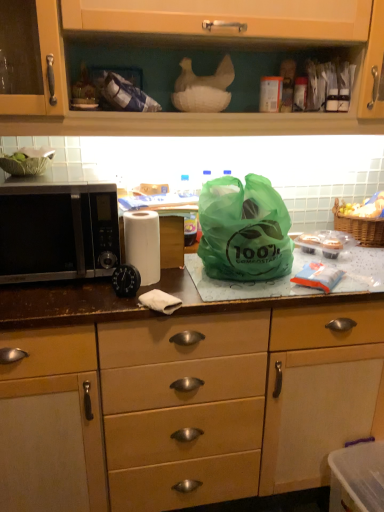
Describe the element at coordinates (365, 207) in the screenshot. This screenshot has height=512, width=384. I see `yellowish matte fruit at upper right` at that location.

Describe the element at coordinates (187, 124) in the screenshot. The width and height of the screenshot is (384, 512). I see `matte wood cabinet at upper center, which is the second cabinetry in bottom-to-top order` at that location.

You are a GUI agent. You are given a task and a screenshot of the screen. Output one action in this format:
    pyautogui.click(x=<x>, y=<y>)
    Task: Click on the woven brown picnic basket at right
    
    Given the screenshot: What is the action you would take?
    pyautogui.click(x=360, y=227)

From the image's perspective, is black matte microwave at left located above or below matte wood cabinet at upper center, which is the second cabinetry in bottom-to-top order?

Clearly, from the image's perspective, black matte microwave at left is below matte wood cabinet at upper center, which is the second cabinetry in bottom-to-top order.

Is black matte microwave at left far away from matte wood cabinet at upper center, positioned as the 1th cabinetry in top-to-bottom order?

No, black matte microwave at left is not far away from matte wood cabinet at upper center, positioned as the 1th cabinetry in top-to-bottom order.

Does black matte microwave at left turn towards matte wood cabinet at upper center, positioned as the 1th cabinetry in top-to-bottom order?

No, black matte microwave at left does not turn towards matte wood cabinet at upper center, positioned as the 1th cabinetry in top-to-bottom order.

Which is more to the left, black matte microwave at left or matte wood cabinet at upper center, which is the second cabinetry in bottom-to-top order?

black matte microwave at left.

Which of these two, black matte microwave at left or green translucent bag at center, is wider?

black matte microwave at left is wider.

Is black matte microwave at left to the right of green translucent bag at center from the viewer's perspective?

Incorrect, black matte microwave at left is not on the right side of green translucent bag at center.

From a real-world perspective, is black matte microwave at left under green translucent bag at center?

Correct, in the physical world, black matte microwave at left is lower than green translucent bag at center.

Would you consider black matte microwave at left to be distant from green translucent bag at center?

That's not correct — black matte microwave at left is a little close to green translucent bag at center.

In terms of width, does black matte microwave at left look wider or thinner when compared to matte brown cabinet at center, which is the 2th cabinetry from top to bottom?

Clearly, black matte microwave at left has less width compared to matte brown cabinet at center, which is the 2th cabinetry from top to bottom.

From the image's perspective, is black matte microwave at left on top of matte brown cabinet at center, which is the 2th cabinetry from top to bottom?

Correct, black matte microwave at left appears higher than matte brown cabinet at center, which is the 2th cabinetry from top to bottom, in the image.

Is black matte microwave at left next to matte brown cabinet at center, acting as the first cabinetry starting from the bottom?

No, black matte microwave at left is not beside matte brown cabinet at center, acting as the first cabinetry starting from the bottom.

Considering the sizes of objects black matte microwave at left and matte brown cabinet at center, acting as the first cabinetry starting from the bottom, in the image provided, who is smaller, black matte microwave at left or matte brown cabinet at center, acting as the first cabinetry starting from the bottom,?

black matte microwave at left.

In the image, there is a matte wood cabinet at upper center, which is the second cabinetry in bottom-to-top order. In order to click on paper towel below it (from the image's perspective) in this screenshot , I will do `click(143, 244)`.

In terms of height, does matte wood cabinet at upper center, positioned as the 1th cabinetry in top-to-bottom order, look taller or shorter compared to white matte paper towel at center?

Clearly, matte wood cabinet at upper center, positioned as the 1th cabinetry in top-to-bottom order, is taller compared to white matte paper towel at center.

Considering the relative positions of matte wood cabinet at upper center, which is the second cabinetry in bottom-to-top order, and white matte paper towel at center in the image provided, is matte wood cabinet at upper center, which is the second cabinetry in bottom-to-top order, to the left or to the right of white matte paper towel at center?

Clearly, matte wood cabinet at upper center, which is the second cabinetry in bottom-to-top order, is on the right of white matte paper towel at center in the image.

Considering the relative sizes of matte wood cabinet at upper center, positioned as the 1th cabinetry in top-to-bottom order, and white matte paper towel at center in the image provided, is matte wood cabinet at upper center, positioned as the 1th cabinetry in top-to-bottom order, thinner than white matte paper towel at center?

No.

Can you confirm if white matte paper towel at center is thinner than black matte microwave at left?

Indeed, white matte paper towel at center has a lesser width compared to black matte microwave at left.

Is white matte paper towel at center to the right of black matte microwave at left from the viewer's perspective?

Yes, white matte paper towel at center is to the right of black matte microwave at left.

Considering the positions of point (140, 267) and point (64, 233), is point (140, 267) closer or farther from the camera than point (64, 233)?

Point (140, 267) is farther from the camera than point (64, 233).

In the scene shown: Are white matte paper towel at center and black matte microwave at left located far from each other?

Actually, white matte paper towel at center and black matte microwave at left are a little close together.

From the image's perspective, is woven brown picnic basket at right beneath matte wood cabinet at upper center, positioned as the 1th cabinetry in top-to-bottom order?

Yes, from the image's perspective, woven brown picnic basket at right is beneath matte wood cabinet at upper center, positioned as the 1th cabinetry in top-to-bottom order.

Which is behind, point (369, 244) or point (157, 133)?

Positioned behind is point (369, 244).

In the scene shown: Is woven brown picnic basket at right directly adjacent to matte wood cabinet at upper center, positioned as the 1th cabinetry in top-to-bottom order?

There is a gap between woven brown picnic basket at right and matte wood cabinet at upper center, positioned as the 1th cabinetry in top-to-bottom order.

Is white matte paper towel at center not close to woven brown picnic basket at right?

No, white matte paper towel at center is not far away from woven brown picnic basket at right.

Which object is closer to the camera taking this photo, white matte paper towel at center or woven brown picnic basket at right?

Positioned in front is white matte paper towel at center.

Considering the positions of points (137, 255) and (360, 230), is point (137, 255) farther from camera compared to point (360, 230)?

No, (137, 255) is in front of (360, 230).

Which of these two, white matte paper towel at center or woven brown picnic basket at right, stands shorter?

woven brown picnic basket at right is shorter.

Locate an element on the screen. The height and width of the screenshot is (512, 384). the 1st cabinetry to the right of the black matte microwave at left, counting from the anchor's position is located at coordinates (187, 124).

In order to click on microwave oven in front of the green translucent bag at center in this screenshot , I will do `click(58, 233)`.

Considering their positions, is yellowish matte fruit at upper right positioned further to green translucent bag at center than woven brown picnic basket at right?

yellowish matte fruit at upper right is positioned further to the anchor green translucent bag at center.

Considering their positions, is woven brown picnic basket at right positioned closer to white matte paper towel at center than matte wood cabinet at upper center, positioned as the 1th cabinetry in top-to-bottom order?

matte wood cabinet at upper center, positioned as the 1th cabinetry in top-to-bottom order.

Which object lies nearer to the anchor point yellowish matte fruit at upper right, woven brown picnic basket at right or green translucent bag at center?

Based on the image, woven brown picnic basket at right appears to be nearer to yellowish matte fruit at upper right.

When comparing their distances from yellowish matte fruit at upper right, does matte brown cabinet at center, which is the 2th cabinetry from top to bottom, or green translucent bag at center seem closer?

green translucent bag at center is positioned closer to the anchor yellowish matte fruit at upper right.

Considering their positions, is black matte microwave at left positioned closer to matte wood cabinet at upper center, which is the second cabinetry in bottom-to-top order, than white matte paper towel at center?

black matte microwave at left is closer to matte wood cabinet at upper center, which is the second cabinetry in bottom-to-top order.

Looking at the image, which one is located further to matte brown cabinet at center, which is the 2th cabinetry from top to bottom, woven brown picnic basket at right or green translucent bag at center?

woven brown picnic basket at right lies further to matte brown cabinet at center, which is the 2th cabinetry from top to bottom, than the other object.

Looking at the image, which one is located further to black matte microwave at left, matte brown cabinet at center, which is the 2th cabinetry from top to bottom, or green translucent bag at center?

The object further to black matte microwave at left is matte brown cabinet at center, which is the 2th cabinetry from top to bottom.

Which object lies further to the anchor point green translucent bag at center, white matte paper towel at center or woven brown picnic basket at right?

woven brown picnic basket at right is positioned further to the anchor green translucent bag at center.

Locate an element on the screen. The width and height of the screenshot is (384, 512). plastic bag situated between black matte microwave at left and woven brown picnic basket at right from left to right is located at coordinates (244, 230).

Locate an element on the screen. The height and width of the screenshot is (512, 384). picnic basket situated between black matte microwave at left and yellowish matte fruit at upper right from left to right is located at coordinates (x=360, y=227).

What are the coordinates of `picnic basket between white matte paper towel at center and yellowish matte fruit at upper right from left to right` in the screenshot? It's located at (360, 227).

You are a GUI agent. You are given a task and a screenshot of the screen. Output one action in this format:
    pyautogui.click(x=<x>, y=<y>)
    Task: Click on the plastic bag between woven brown picnic basket at right and matte brown cabinet at center, which is the 2th cabinetry from top to bottom, in the up-down direction
    The height and width of the screenshot is (512, 384).
    Given the screenshot: What is the action you would take?
    pyautogui.click(x=244, y=230)